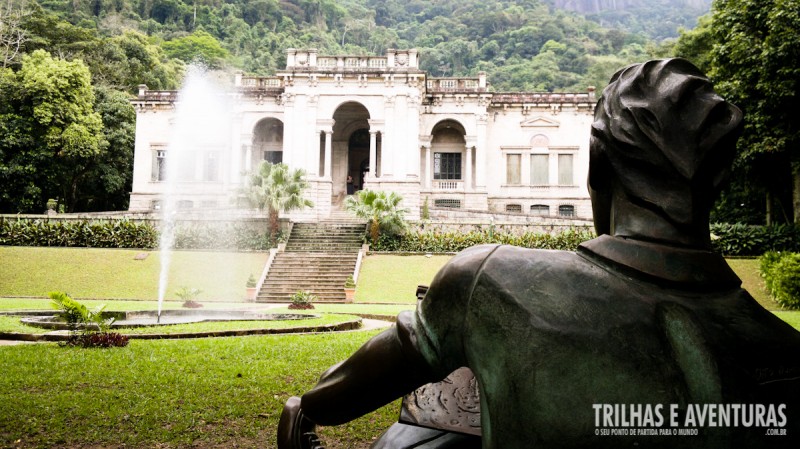
I want to click on plant pots at the bottom of the stairs, so click(x=349, y=292), click(x=250, y=288).